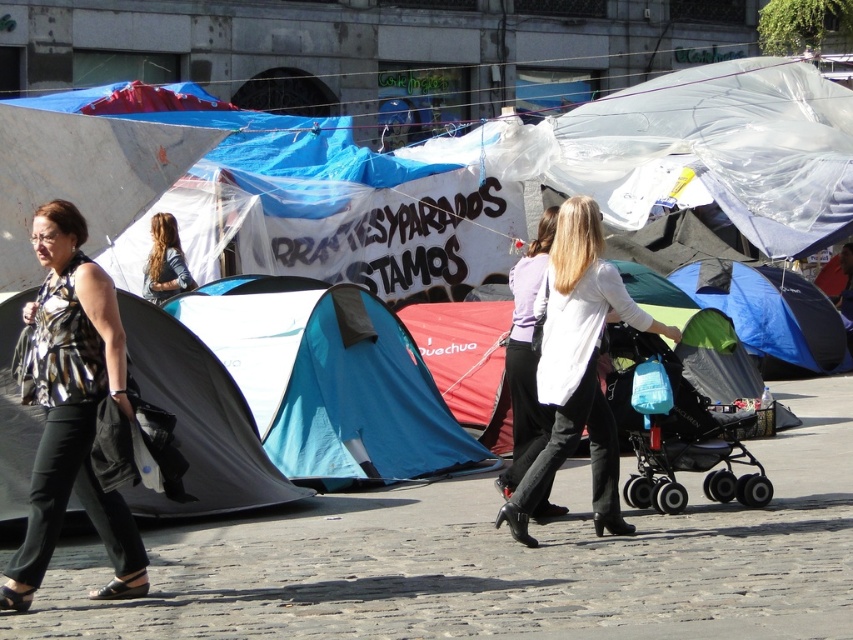
Question: Which point is closer to the camera taking this photo?

Choices:
 (A) (526, 308)
 (B) (250, 392)

Answer: (A)

Question: Which point appears closest to the camera in this image?

Choices:
 (A) (88, 420)
 (B) (409, 472)
 (C) (767, 305)

Answer: (A)

Question: Does white matte shirt at center have a larger size compared to blue denim jacket at center?

Choices:
 (A) no
 (B) yes

Answer: (B)

Question: Where is green fabric stroller at center located in relation to blue fabric tent at center-right in the image?

Choices:
 (A) left
 (B) right

Answer: (A)

Question: Which point is closer to the camera?

Choices:
 (A) (788, 288)
 (B) (595, 332)

Answer: (B)

Question: Can you confirm if black fabric tent at left is thinner than matte white blouse at center?

Choices:
 (A) yes
 (B) no

Answer: (B)